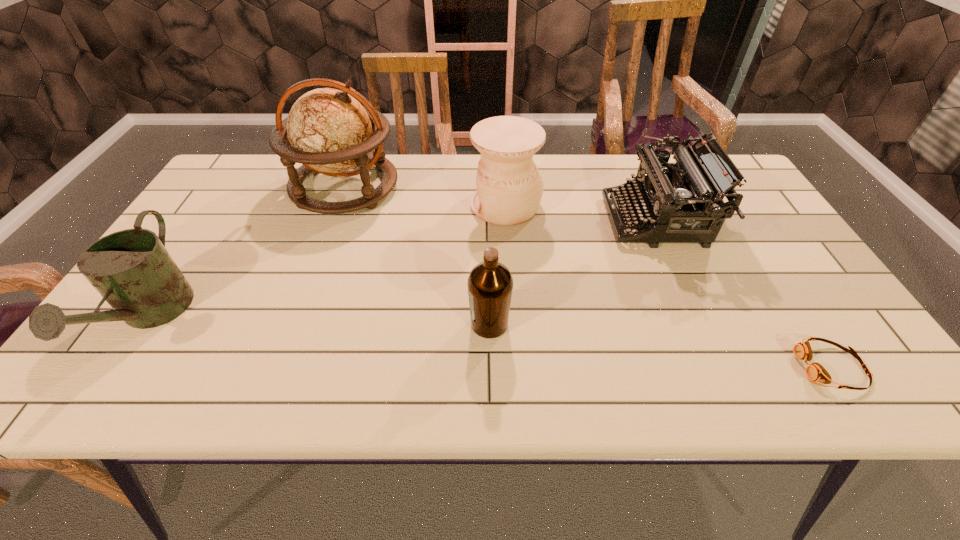
Locate an element on the screen. the tallest object is located at coordinates (329, 131).

Identify the location of the fifth object from right to left. The image size is (960, 540). (329, 131).

This screenshot has height=540, width=960. I want to click on pottery, so click(x=509, y=185).

The image size is (960, 540). What are the coordinates of `typewriter` in the screenshot? It's located at (661, 194).

Identify the location of olive oil. (490, 284).

The width and height of the screenshot is (960, 540). I want to click on the leftmost object, so click(x=131, y=269).

In order to click on the rightmost object in this screenshot , I will do `click(815, 372)`.

Identify the location of the shortest object. This screenshot has height=540, width=960. (815, 372).

The height and width of the screenshot is (540, 960). I want to click on vacant space located on the right of the tallest object, so (452, 187).

At what (x,y) coordinates should I click in order to perform the action: click on vacant space situated 0.150m at the open side of the pottery. Please return your answer as a coordinate pair (x, y). The width and height of the screenshot is (960, 540). Looking at the image, I should click on (417, 205).